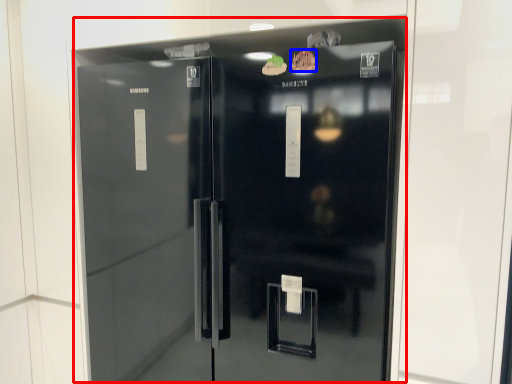
Question: Which object appears farthest to the camera in this image, refrigerator (highlighted by a red box) or food (highlighted by a blue box)?

Choices:
 (A) refrigerator
 (B) food

Answer: (B)